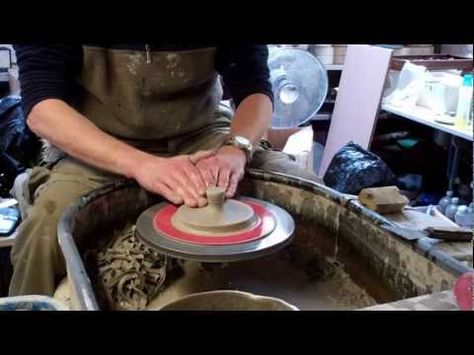
Image resolution: width=474 pixels, height=355 pixels. I want to click on bottles, so click(443, 196), click(448, 207), click(460, 215).